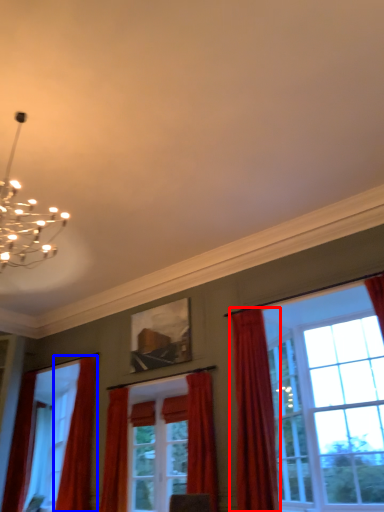
Question: Among these objects, which one is farthest to the camera, curtain (highlighted by a red box) or curtain (highlighted by a blue box)?

Choices:
 (A) curtain
 (B) curtain

Answer: (B)